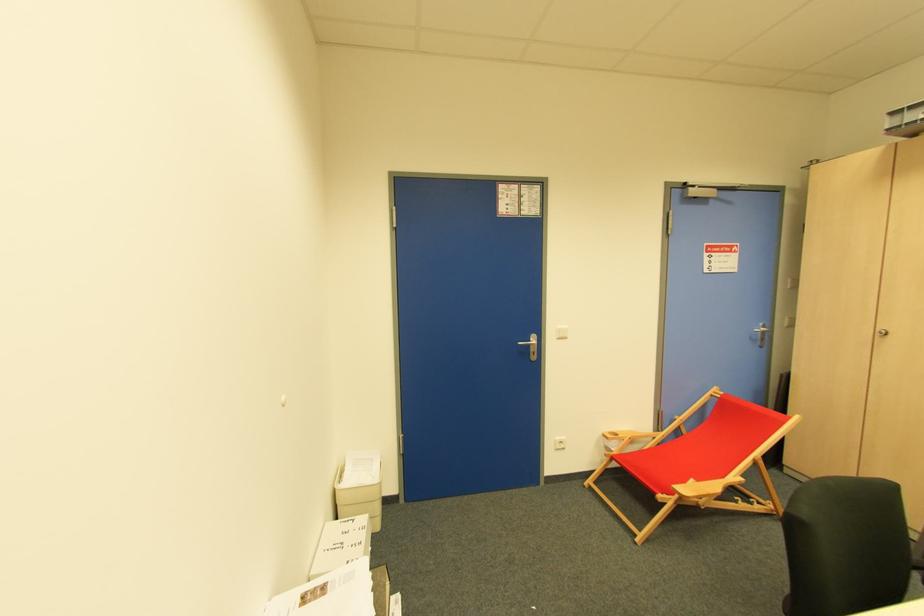
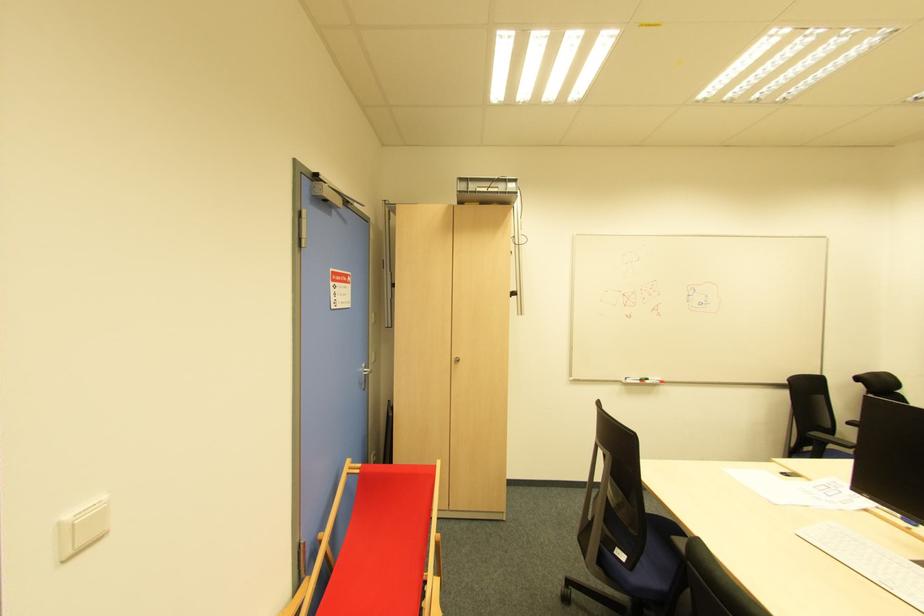
In the second image, find the point that corresponds to point 762,341 in the first image.

(366, 382)